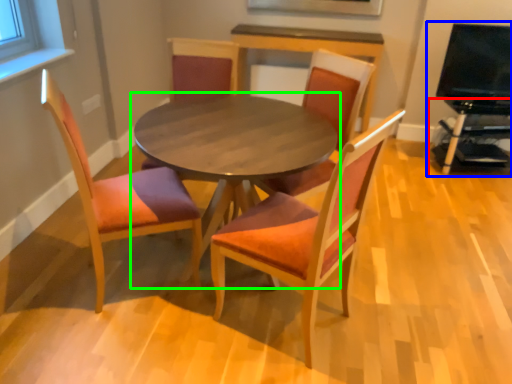
Question: Considering the real-world distances, which object is closest to entertainment center (highlighted by a red box)? entertainment center (highlighted by a blue box) or coffee table (highlighted by a green box).

Choices:
 (A) entertainment center
 (B) coffee table

Answer: (A)